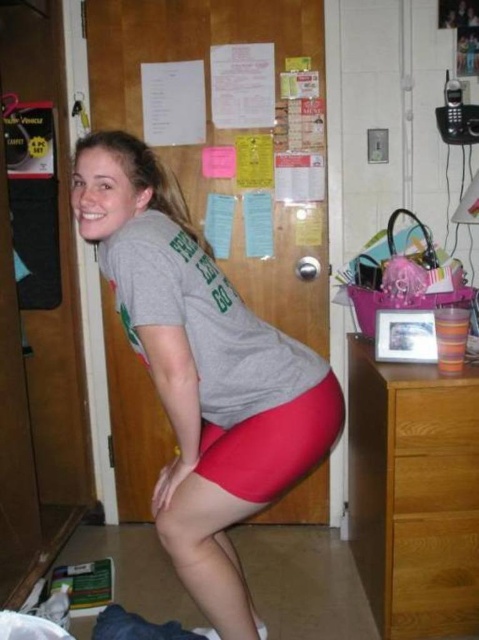
Who is higher up, matte red shorts at center or brown wooden dresser at right?

Positioned higher is matte red shorts at center.

Which is behind, point (160, 518) or point (365, 444)?

The point (365, 444) is behind.

Who is more distant from viewer, (212, 502) or (375, 554)?

Point (375, 554)

I want to click on matte red shorts at center, so click(x=203, y=372).

Can you confirm if brown wooden dresser at right is bigger than wooden drawer at lower right?

Correct, brown wooden dresser at right is larger in size than wooden drawer at lower right.

Is point (452, 500) positioned before point (417, 404)?

That is False.

The image size is (479, 640). What are the coordinates of `brown wooden dresser at right` in the screenshot? It's located at (413, 493).

Between matte red shorts at center and wooden drawer at lower right, which one has less height?

With less height is wooden drawer at lower right.

Is matte red shorts at center positioned at the back of wooden drawer at lower right?

No.

In order to click on matte red shorts at center in this screenshot , I will do point(203,372).

I want to click on matte red shorts at center, so click(x=203, y=372).